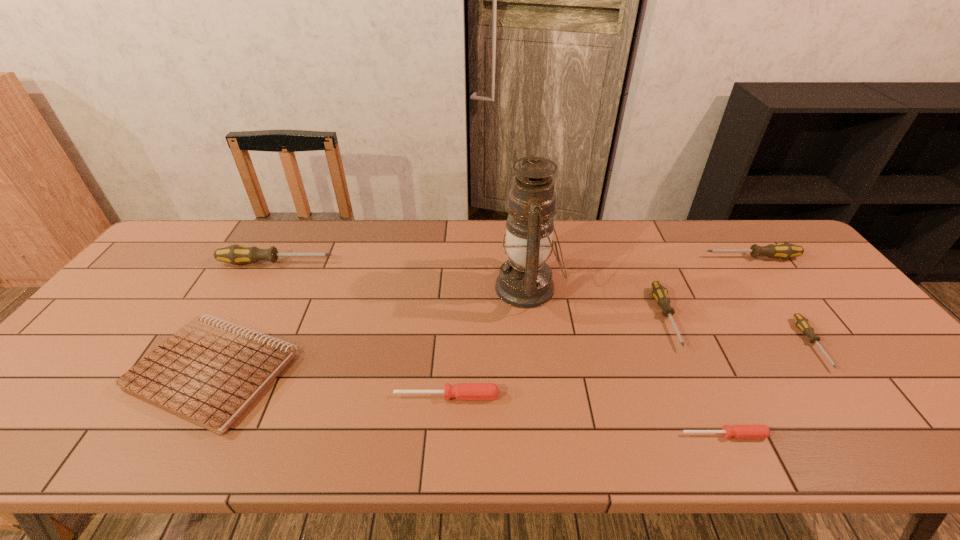
Where is `the fourth object from left to right`? The width and height of the screenshot is (960, 540). the fourth object from left to right is located at coordinates (525, 281).

Where is `oil lamp`? This screenshot has width=960, height=540. oil lamp is located at coordinates (525, 281).

Locate an element on the screen. the leftmost gray screwdriver is located at coordinates (236, 254).

The width and height of the screenshot is (960, 540). What are the coordinates of `the biggest gray screwdriver` in the screenshot? It's located at (236, 254).

Locate an element on the screen. Image resolution: width=960 pixels, height=540 pixels. the second biggest gray screwdriver is located at coordinates (784, 250).

Identify the location of the sixth shortest object. This screenshot has height=540, width=960. (784, 250).

Find the location of a particular element. the second smallest gray screwdriver is located at coordinates (659, 292).

I want to click on the fourth tallest object, so click(659, 292).

Identify the location of notebook. The height and width of the screenshot is (540, 960). (209, 373).

Identify the location of the left red screwdriver. This screenshot has width=960, height=540. (463, 391).